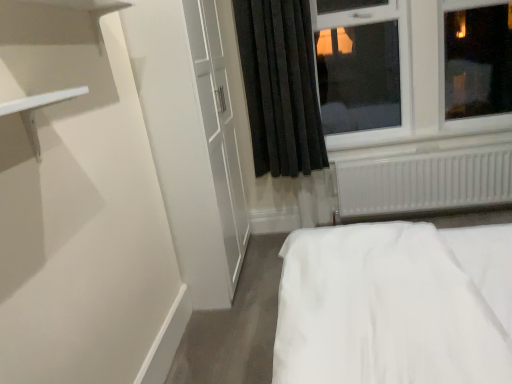
Measure the distance between white plastic radiator at lower right and camera.

white plastic radiator at lower right and camera are 10.28 feet apart.

Describe the element at coordinates (424, 182) in the screenshot. I see `white plastic radiator at lower right` at that location.

Locate an element on the screen. black velvet curtain at upper center is located at coordinates (280, 86).

This screenshot has width=512, height=384. What do you see at coordinates (412, 69) in the screenshot? I see `white plastic window at upper right` at bounding box center [412, 69].

This screenshot has height=384, width=512. I want to click on white plastic radiator at lower right, so click(x=424, y=182).

Is black velvet curtain at upper center surrounded by white plastic window at upper right?

No, white plastic window at upper right does not contain black velvet curtain at upper center.

Which is in front, point (497, 14) or point (256, 89)?

Positioned in front is point (256, 89).

From a real-world perspective, who is located higher, white plastic window at upper right or black velvet curtain at upper center?

white plastic window at upper right, from a real-world perspective.

What's the angular difference between white plastic window at upper right and black velvet curtain at upper center's facing directions?

They differ by 1.54 degrees in their facing directions.

Does black velvet curtain at upper center have a lesser width compared to white plastic radiator at lower right?

No.

Between black velvet curtain at upper center and white plastic radiator at lower right, which one has larger size?

black velvet curtain at upper center.

Who is shorter, black velvet curtain at upper center or white plastic radiator at lower right?

white plastic radiator at lower right.

Is point (277, 169) positioned in front of point (381, 188)?

Yes, it is.

Considering the positions of objects white plastic window at upper right and white plastic radiator at lower right in the image provided, who is more to the right, white plastic window at upper right or white plastic radiator at lower right?

white plastic radiator at lower right is more to the right.

Is white plastic window at upper right bigger than white plastic radiator at lower right?

Yes, white plastic window at upper right is bigger than white plastic radiator at lower right.

Is white plastic window at upper right positioned far away from white plastic radiator at lower right?

white plastic window at upper right is near white plastic radiator at lower right, not far away.

From the image's perspective, does white plastic window at upper right appear higher than white plastic radiator at lower right?

Yes.

Is white plastic radiator at lower right facing towards black velvet curtain at upper center?

No, white plastic radiator at lower right is not aimed at black velvet curtain at upper center.

Is white plastic radiator at lower right at the right side of black velvet curtain at upper center?

Yes.

Does white plastic radiator at lower right have a lesser width compared to black velvet curtain at upper center?

Correct, the width of white plastic radiator at lower right is less than that of black velvet curtain at upper center.

At what (x,y) coordinates should I click in order to perform the action: click on radiator below the black velvet curtain at upper center (from the image's perspective). Please return your answer as a coordinate pair (x, y). Looking at the image, I should click on (424, 182).

Which object is more forward, black velvet curtain at upper center or white plastic window at upper right?

black velvet curtain at upper center is more forward.

Is black velvet curtain at upper center smaller than white plastic window at upper right?

Yes, black velvet curtain at upper center is smaller than white plastic window at upper right.

Which is farther from the camera, (x=319, y=161) or (x=502, y=62)?

The point (x=502, y=62) is behind.

Could you tell me if black velvet curtain at upper center is turned towards white plastic window at upper right?

No, black velvet curtain at upper center is not oriented towards white plastic window at upper right.

Is white plastic window at upper right surrounded by white plastic radiator at lower right?

No, white plastic window at upper right is not inside white plastic radiator at lower right.

Considering the relative positions of white plastic radiator at lower right and white plastic window at upper right in the image provided, is white plastic radiator at lower right to the left of white plastic window at upper right from the viewer's perspective?

No, white plastic radiator at lower right is not to the left of white plastic window at upper right.

Find the location of a particular element. The width and height of the screenshot is (512, 384). radiator beneath the white plastic window at upper right (from a real-world perspective) is located at coordinates (424, 182).

Which of these two, white plastic radiator at lower right or white plastic window at upper right, is bigger?

white plastic window at upper right.

The height and width of the screenshot is (384, 512). I want to click on curtain below the white plastic window at upper right (from the image's perspective), so click(280, 86).

Find the location of a particular element. Image resolution: width=512 pixels, height=384 pixels. radiator that is under the black velvet curtain at upper center (from a real-world perspective) is located at coordinates (424, 182).

Estimate the real-world distances between objects in this image. Which object is further from black velvet curtain at upper center, white plastic window at upper right or white plastic radiator at lower right?

Among the two, white plastic radiator at lower right is located further to black velvet curtain at upper center.

Considering their positions, is black velvet curtain at upper center positioned further to white plastic window at upper right than white plastic radiator at lower right?

black velvet curtain at upper center.

When comparing their distances from white plastic radiator at lower right, does black velvet curtain at upper center or white plastic window at upper right seem closer?

Based on the image, white plastic window at upper right appears to be nearer to white plastic radiator at lower right.

From the picture: Considering their positions, is white plastic radiator at lower right positioned closer to black velvet curtain at upper center than white plastic window at upper right?

Based on the image, white plastic window at upper right appears to be nearer to black velvet curtain at upper center.

Looking at the image, which one is located further to white plastic radiator at lower right, white plastic window at upper right or black velvet curtain at upper center?

Among the two, black velvet curtain at upper center is located further to white plastic radiator at lower right.

Based on the photo, looking at the image, which one is located closer to white plastic window at upper right, white plastic radiator at lower right or black velvet curtain at upper center?

white plastic radiator at lower right.

Locate an element on the screen. window situated between black velvet curtain at upper center and white plastic radiator at lower right from left to right is located at coordinates (412, 69).